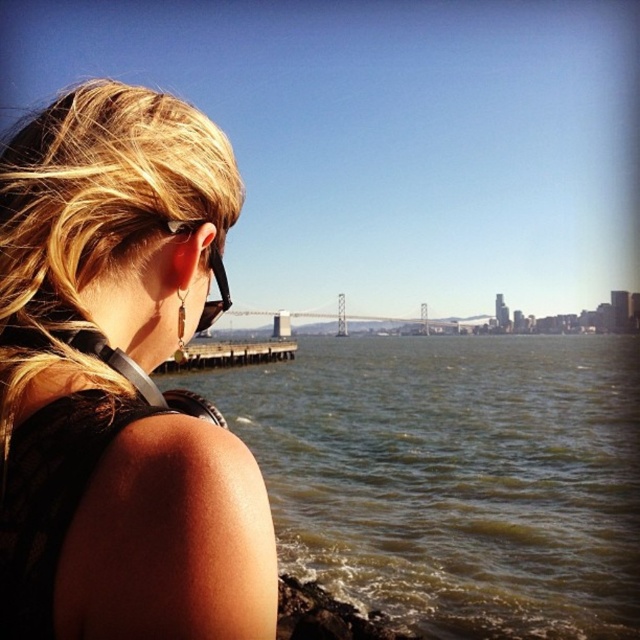
Is the position of greenish water at lower left less distant than that of black plastic goggles at upper left?

No, greenish water at lower left is further to the viewer.

Is greenish water at lower left shorter than black plastic goggles at upper left?

No.

Does point (596, 442) lie behind point (211, 253)?

Yes, point (596, 442) is farther from viewer.

Locate an element on the screen. greenish water at lower left is located at coordinates (452, 477).

This screenshot has width=640, height=640. I want to click on blonde hair at upper left, so click(120, 381).

Who is higher up, blonde hair at upper left or black plastic goggles at upper left?

black plastic goggles at upper left

At what (x,y) coordinates should I click in order to perform the action: click on blonde hair at upper left. Please return your answer as a coordinate pair (x, y). Looking at the image, I should click on (120, 381).

This screenshot has width=640, height=640. What are the coordinates of `blonde hair at upper left` in the screenshot? It's located at (120, 381).

Measure the distance between blonde hair at upper left and greenish water at lower left.

They are 245.42 feet apart.

Find the location of a particular element. Image resolution: width=640 pixels, height=640 pixels. blonde hair at upper left is located at coordinates (120, 381).